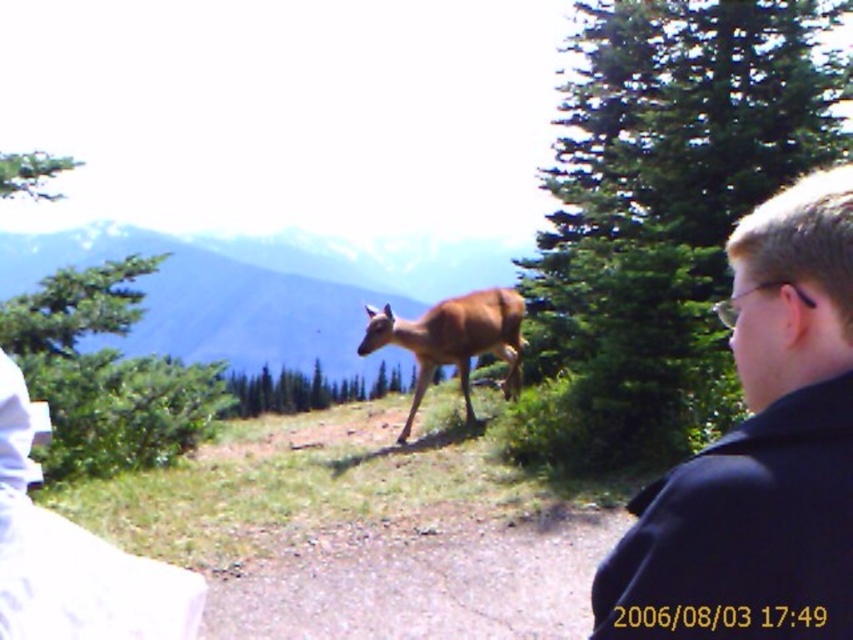
You are standing on the paved path and want to determine which of the two points, point (294, 339) or point (512, 324), is closer to you. Which point is nearer?

Point (294, 339) is further to the viewer than point (512, 324), so the point closer to you is point (512, 324).

You are a hiker trying to take a photo of the brown fur deer at center without disturbing it. The deer is sensitive to movement from the left side. You currently stand behind the dark blue jacket at right. Which direction should you move to position yourself safely?

You should move to the right side of the dark blue jacket at right. Since the dark blue jacket at right is already positioned to the right of the brown fur deer at center, moving further right keeps you out of the deer s sensitive left side area, allowing you to take the photo without disturbing it.